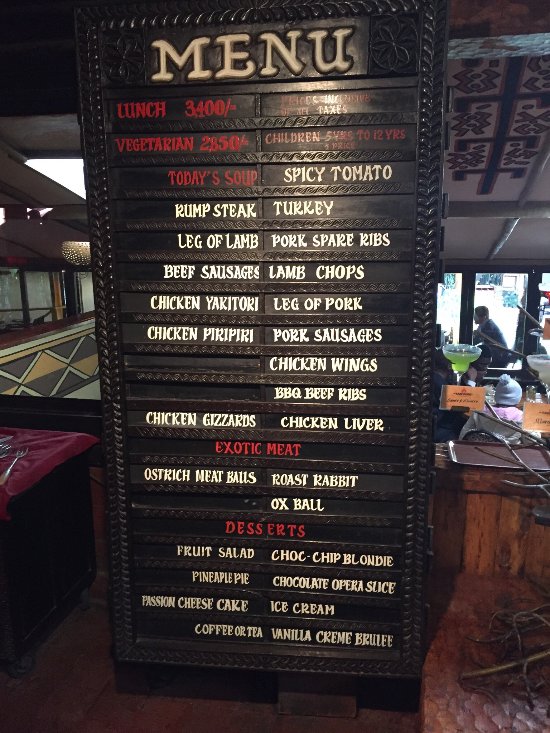
Where is `wall`? wall is located at coordinates (78, 350).